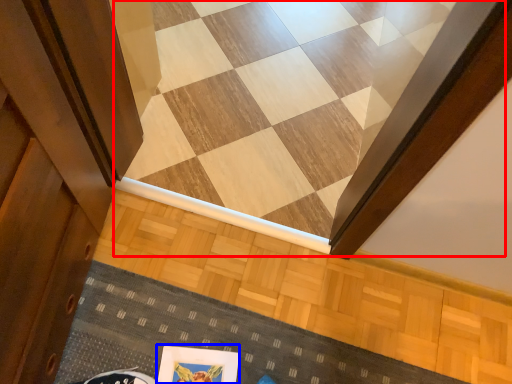
Question: Which point is closer to the camera, stairwell (highlighted by a red box) or picture frame (highlighted by a blue box)?

Choices:
 (A) stairwell
 (B) picture frame

Answer: (B)